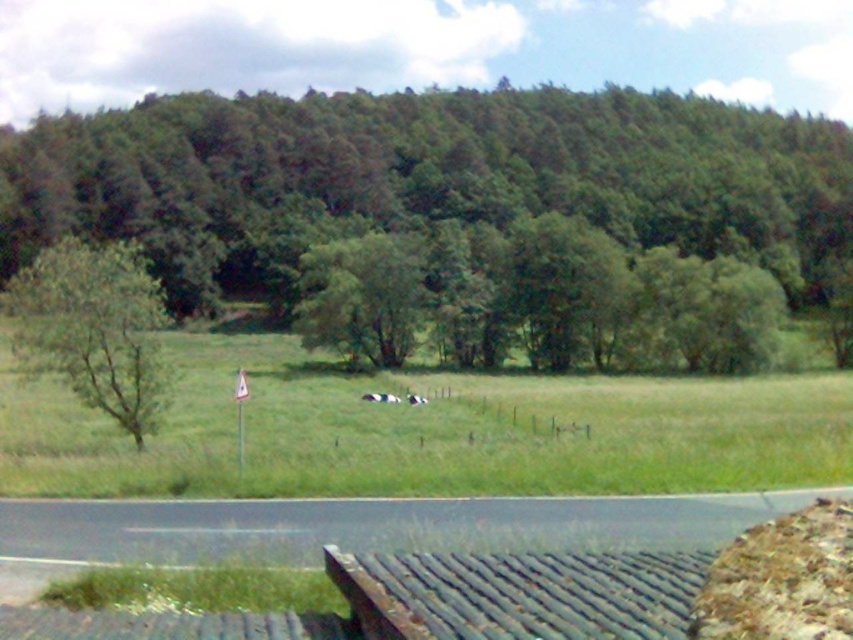
Can you confirm if green leafy tree at upper center is smaller than green leafy tree at center?

Incorrect, green leafy tree at upper center is not smaller in size than green leafy tree at center.

Is green leafy tree at upper center positioned before green leafy tree at center?

No, it is not.

Identify the location of green leafy tree at upper center. (426, 179).

Is rusty metal bench at lower center above green leafy tree at left?

Actually, rusty metal bench at lower center is below green leafy tree at left.

Who is lower down, rusty metal bench at lower center or green leafy tree at left?

rusty metal bench at lower center

Which is behind, point (433, 588) or point (102, 360)?

The point (102, 360) is behind.

Where is `rusty metal bench at lower center`? The height and width of the screenshot is (640, 853). rusty metal bench at lower center is located at coordinates [521, 593].

Is green grass at center smaller than green leafy tree at left?

Correct, green grass at center occupies less space than green leafy tree at left.

Does green grass at center appear under green leafy tree at left?

Yes.

Does point (77, 413) come behind point (141, 250)?

Yes, it is.

Find the location of `green grass at center`. green grass at center is located at coordinates (427, 432).